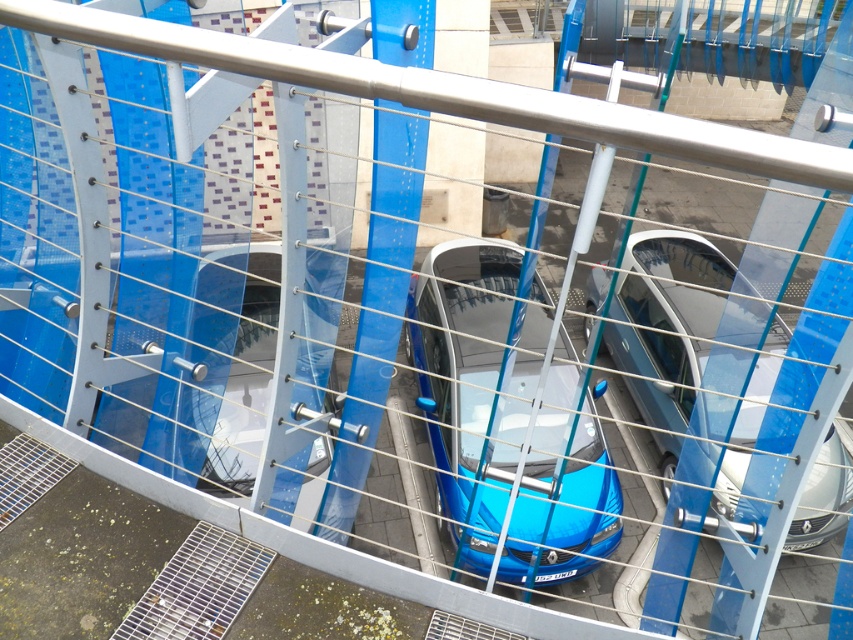
You are standing in the parking structure and see two cars labeled as blue glossy car at center and glossy blue car at center. Which one is nearer to you?

The blue glossy car at center is closer to the viewer than the glossy blue car at center.

You are standing at the entrance of the parking structure and see the point marked at coordinates (508, 419). Which object does this point correspond to?

The point at coordinates (508, 419) corresponds to the blue glossy car at center.

You are standing at the entrance of the parking structure and see two cars labeled as blue glossy car at center and glossy blue car at center. Which one is positioned lower in the scene?

The blue glossy car at center is positioned lower than the glossy blue car at center.